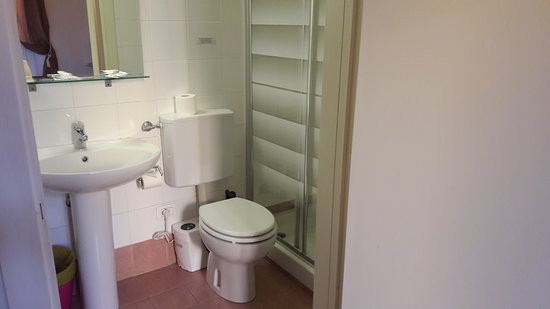
Locate an element on the screen. The width and height of the screenshot is (550, 309). curtain shower is located at coordinates (286, 113).